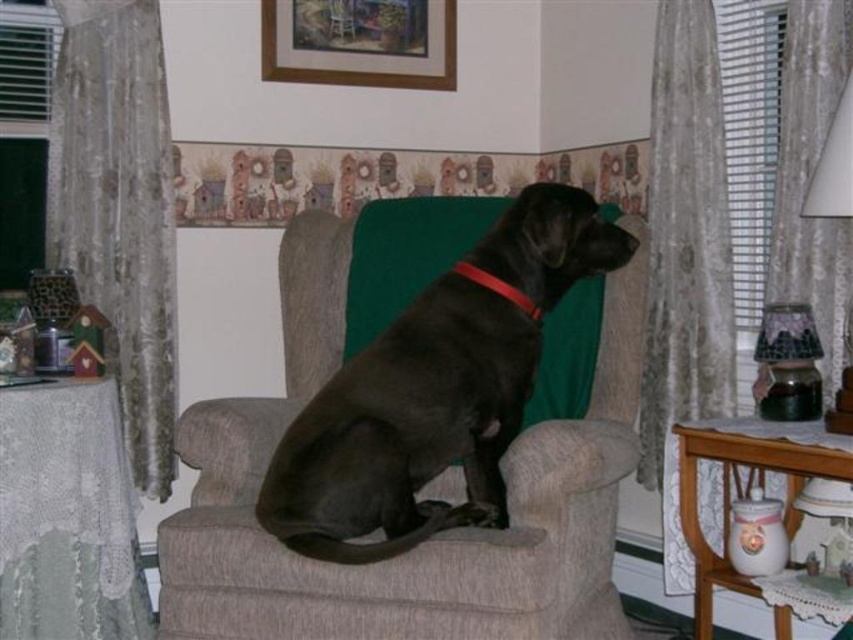
Question: Which point is closer to the camera?

Choices:
 (A) white lace curtain at right
 (B) black smooth dog at center
 (C) sheer floral lace curtain at right

Answer: (B)

Question: Does black smooth dog at center have a lesser width compared to wooden picture frame at upper center?

Choices:
 (A) yes
 (B) no

Answer: (B)

Question: Can you confirm if white lace curtain at right is thinner than wooden picture frame at upper center?

Choices:
 (A) yes
 (B) no

Answer: (A)

Question: Does black smooth dog at center come in front of sheer floral lace curtain at right?

Choices:
 (A) yes
 (B) no

Answer: (A)

Question: Among these points, which one is farthest from the camera?

Choices:
 (A) (357, 500)
 (B) (149, 218)
 (C) (654, 458)

Answer: (C)

Question: Among these objects, which one is farthest from the camera?

Choices:
 (A) red leather collar at center
 (B) black smooth dog at center

Answer: (A)